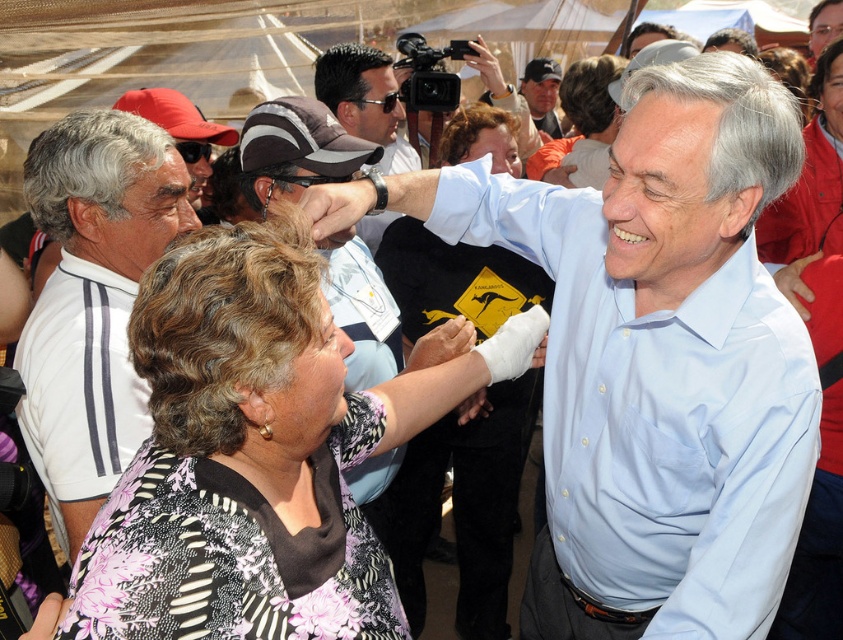
Where is the matte gray cap at center located in the image?

The matte gray cap at center is located at point coordinates of 0.236 on the x axis and 0.351 on the y axis.

You are a photographer at the event and need to capture a clear photo of both the matte gray cap at center and the matte black cap at upper center. Given their heights, which cap should you focus on first to ensure it doesn

The matte gray cap at center is taller than the matte black cap at upper center, so you should focus on the matte gray cap at center first to ensure it is in clear view before adjusting the camera angle for the smaller matte black cap at upper center.

You are organizing a photo shoot and need to place two caps on a shelf. The shelf can only hold items where the wider item is placed behind the narrower one for stability. Given the matte gray cap at center and the matte black cap at upper center, which cap should be placed behind the other?

The matte gray cap at center should be placed behind the matte black cap at upper center because the matte gray cap at center is wider, ensuring stability as per the requirement.